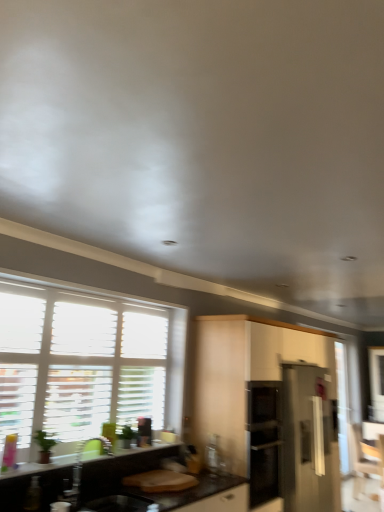
This screenshot has width=384, height=512. What do you see at coordinates (342, 405) in the screenshot?
I see `transparent glass screen door at right` at bounding box center [342, 405].

Looking at this image, what is the approximate height of black matte sink at lower left?

It is 41.15 centimeters.

What do you see at coordinates (309, 440) in the screenshot? I see `stainless steel refrigerator at right` at bounding box center [309, 440].

Locate an element on the screen. The image size is (384, 512). stainless steel refrigerator at right is located at coordinates (309, 440).

Where is `white wood window at left`? The image size is (384, 512). white wood window at left is located at coordinates click(85, 364).

The width and height of the screenshot is (384, 512). What do you see at coordinates (362, 460) in the screenshot?
I see `wooden armchair at lower right` at bounding box center [362, 460].

Locate an element on the screen. wooden armchair at lower right is located at coordinates pos(362,460).

What is the approximate width of satin white cabinet at center?

21.90 inches.

The height and width of the screenshot is (512, 384). In order to click on black laminate countertop at lower left in this screenshot , I will do `click(127, 463)`.

Is black matte sink at lower left wider than wooden armchair at lower right?

No.

Is point (65, 487) closer or farther from the camera than point (377, 442)?

Point (65, 487) is positioned closer to the camera compared to point (377, 442).

From the image's perspective, which object appears higher, black matte sink at lower left or wooden armchair at lower right?

black matte sink at lower left is shown above in the image.

Is wooden armchair at lower right at the back of black matte sink at lower left?

No, wooden armchair at lower right is not at the back of black matte sink at lower left.

What's the angular difference between satin white cabinet at center and white wood window at left's facing directions?

satin white cabinet at center and white wood window at left are facing 0.391 degrees away from each other.

Is satin white cabinet at center looking in the opposite direction of white wood window at left?

No.

In terms of height, does satin white cabinet at center look taller or shorter compared to white wood window at left?

In the image, satin white cabinet at center appears to be taller than white wood window at left.

From the image's perspective, is satin white cabinet at center located above or below white wood window at left?

Clearly, from the image's perspective, satin white cabinet at center is below white wood window at left.

Consider the image. From a real-world perspective, is stainless steel refrigerator at right below transparent glass screen door at right?

Correct, in the physical world, stainless steel refrigerator at right is lower than transparent glass screen door at right.

Can you confirm if stainless steel refrigerator at right is taller than transparent glass screen door at right?

In fact, stainless steel refrigerator at right may be shorter than transparent glass screen door at right.

Which object is further away from the camera, black laminate countertop at lower left or stainless steel refrigerator at right?

stainless steel refrigerator at right is further from the camera.

In the image, there is a black laminate countertop at lower left. Where is `appliance below it (from a real-world perspective)`? appliance below it (from a real-world perspective) is located at coordinates [309, 440].

From the image's perspective, which one is positioned higher, black laminate countertop at lower left or stainless steel refrigerator at right?

black laminate countertop at lower left appears higher in the image.

Is satin white cabinet at center in front of or behind black matte sink at lower left in the image?

satin white cabinet at center is positioned farther from the viewer than black matte sink at lower left.

In terms of height, does satin white cabinet at center look taller or shorter compared to black matte sink at lower left?

In the image, satin white cabinet at center appears to be taller than black matte sink at lower left.

Which point is more distant from viewer, (269, 368) or (77, 500)?

The point (269, 368) is more distant.

Does satin white cabinet at center have a larger size compared to black matte sink at lower left?

Yes, satin white cabinet at center is bigger than black matte sink at lower left.

Looking at their sizes, would you say satin white cabinet at center is wider or thinner than stainless steel refrigerator at right?

satin white cabinet at center is thinner than stainless steel refrigerator at right.

Relative to stainless steel refrigerator at right, is satin white cabinet at center in front or behind?

Clearly, satin white cabinet at center is in front of stainless steel refrigerator at right.

Where is `cabinetry on the left of stainless steel refrigerator at right`? The image size is (384, 512). cabinetry on the left of stainless steel refrigerator at right is located at coordinates (246, 372).

Is satin white cabinet at center outside of stainless steel refrigerator at right?

Yes, satin white cabinet at center is not within stainless steel refrigerator at right.

Which is correct: transparent glass screen door at right is inside black matte sink at lower left, or outside of it?

transparent glass screen door at right is outside black matte sink at lower left.

From a real-world perspective, is transparent glass screen door at right physically above black matte sink at lower left?

Correct, in the physical world, transparent glass screen door at right is higher than black matte sink at lower left.

Consider the image. Is transparent glass screen door at right at the left side of black matte sink at lower left?

No.

Considering the sizes of objects transparent glass screen door at right and black matte sink at lower left in the image provided, who is wider, transparent glass screen door at right or black matte sink at lower left?

black matte sink at lower left.

Image resolution: width=384 pixels, height=512 pixels. What are the coordinates of `armchair behind the black matte sink at lower left` in the screenshot? It's located at (362, 460).

Identify the location of window in front of the satin white cabinet at center. (85, 364).

Based on their spatial positions, is white wood window at left or transparent glass screen door at right closer to wooden armchair at lower right?

Based on the image, transparent glass screen door at right appears to be nearer to wooden armchair at lower right.

Considering their positions, is transparent glass screen door at right positioned further to wooden armchair at lower right than black matte sink at lower left?

black matte sink at lower left is positioned further to the anchor wooden armchair at lower right.

Looking at the image, which one is located further to transparent glass screen door at right, white wood window at left or black laminate countertop at lower left?

Among the two, white wood window at left is located further to transparent glass screen door at right.

Looking at the image, which one is located further to satin white cabinet at center, wooden armchair at lower right or white wood window at left?

Among the two, wooden armchair at lower right is located further to satin white cabinet at center.

Looking at the image, which one is located further to white wood window at left, black laminate countertop at lower left or black matte sink at lower left?

black matte sink at lower left is positioned further to the anchor white wood window at left.

Estimate the real-world distances between objects in this image. Which object is closer to black laminate countertop at lower left, wooden armchair at lower right or transparent glass screen door at right?

Based on the image, transparent glass screen door at right appears to be nearer to black laminate countertop at lower left.

Which object lies nearer to the anchor point satin white cabinet at center, white wood window at left or stainless steel refrigerator at right?

stainless steel refrigerator at right is closer to satin white cabinet at center.

Looking at the image, which one is located further to black matte sink at lower left, stainless steel refrigerator at right or satin white cabinet at center?

Among the two, stainless steel refrigerator at right is located further to black matte sink at lower left.

You are a GUI agent. You are given a task and a screenshot of the screen. Output one action in this format:
    pyautogui.click(x=<x>, y=<y>)
    Task: Click on the sink located between black laminate countertop at lower left and transparent glass screen door at right in the depth direction
    
    Given the screenshot: What is the action you would take?
    pyautogui.click(x=79, y=475)

The width and height of the screenshot is (384, 512). In order to click on appliance between white wood window at left and transparent glass screen door at right from front to back in this screenshot , I will do `click(309, 440)`.

I want to click on appliance between satin white cabinet at center and wooden armchair at lower right from front to back, so click(309, 440).

Where is `countertop between black matte sink at lower left and satin white cabinet at center from left to right`? countertop between black matte sink at lower left and satin white cabinet at center from left to right is located at coordinates [127, 463].